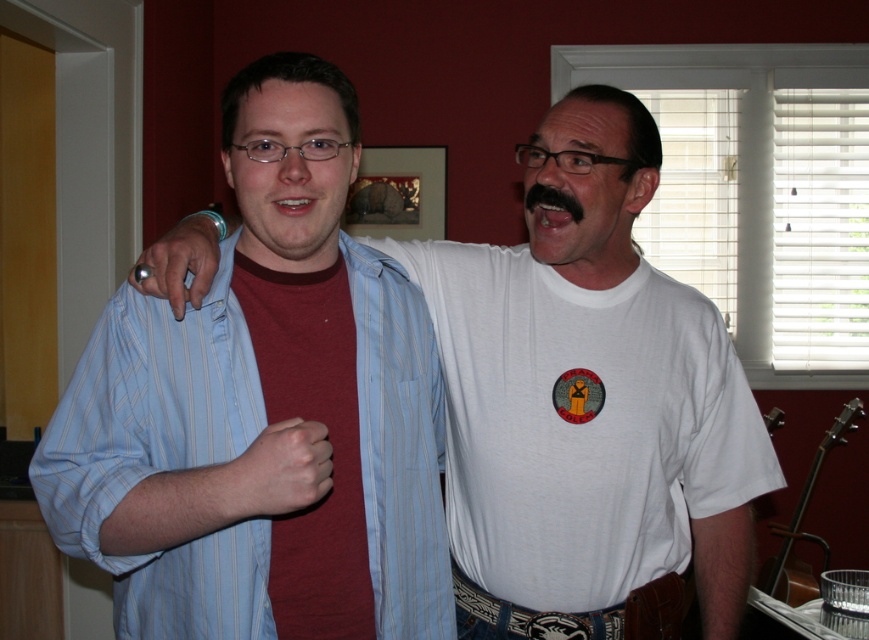
Does light blue striped shirt at center appear under black fuzzy mustache at upper center?

Correct, light blue striped shirt at center is located below black fuzzy mustache at upper center.

Who is higher up, light blue striped shirt at center or black fuzzy mustache at upper center?

black fuzzy mustache at upper center is above.

Based on the photo, who is more distant from viewer, (95, 529) or (556, 209)?

The point (556, 209) is more distant.

At what (x,y) coordinates should I click in order to perform the action: click on light blue striped shirt at center. Please return your answer as a coordinate pair (x, y). Looking at the image, I should click on (161, 458).

Who is more distant from viewer, [758,419] or [531,195]?

The point [758,419] is more distant.

Based on the photo, between blue striped shirt at center and black fuzzy mustache at upper center, which one appears on the right side from the viewer's perspective?

From the viewer's perspective, blue striped shirt at center appears more on the right side.

Image resolution: width=869 pixels, height=640 pixels. What do you see at coordinates (594, 396) in the screenshot?
I see `blue striped shirt at center` at bounding box center [594, 396].

Where is `blue striped shirt at center`? This screenshot has width=869, height=640. blue striped shirt at center is located at coordinates (594, 396).

From the picture: Can you confirm if blue striped shirt at center is thinner than glossy pink lips at center?

Incorrect, blue striped shirt at center's width is not less than glossy pink lips at center's.

This screenshot has width=869, height=640. Describe the element at coordinates (594, 396) in the screenshot. I see `blue striped shirt at center` at that location.

Image resolution: width=869 pixels, height=640 pixels. What do you see at coordinates (594, 396) in the screenshot? I see `blue striped shirt at center` at bounding box center [594, 396].

This screenshot has width=869, height=640. I want to click on blue striped shirt at center, so [594, 396].